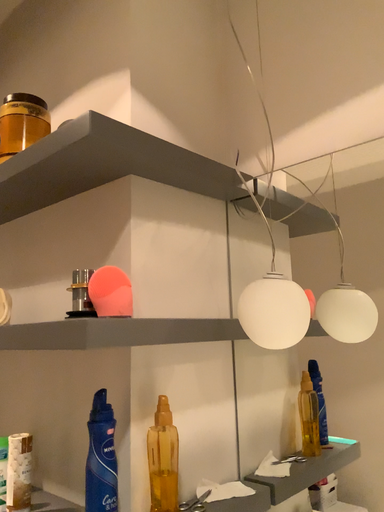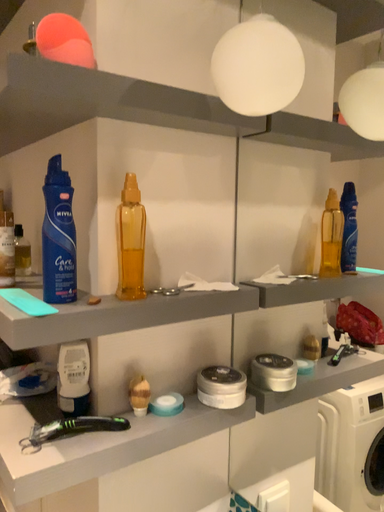
Question: Which way did the camera rotate in the video?

Choices:
 (A) rotated downward
 (B) rotated upward

Answer: (A)